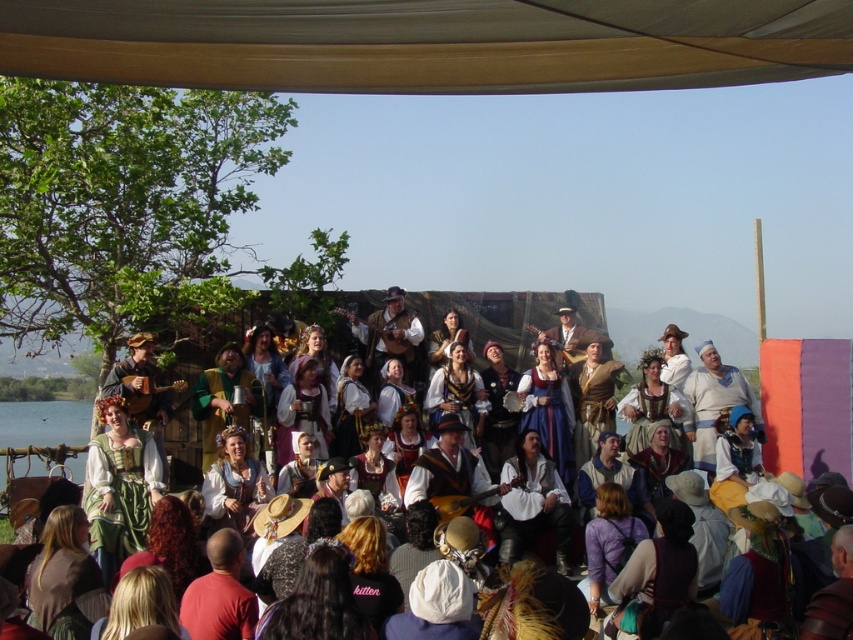
You are an event planner setting up a photo shoot for the performers. You want to ensure that the white cotton dress at center is fully visible in the photo without being blocked by the gray fabric canopy at upper center. Given their sizes, is this possible?

The gray fabric canopy at upper center is smaller than the white cotton dress at center, so it is possible to position the camera in a way that the canopy does not block the dress entirely. Adjusting the angle or distance might help achieve full visibility of the white cotton dress at center.

You are a photographer trying to capture a clear shot of the white cotton dress at center without the gray fabric canopy at upper center blocking the view. Is the canopy shorter than the dress?

The gray fabric canopy at upper center is shorter than the white cotton dress at center, so it will not block the view of the dress.